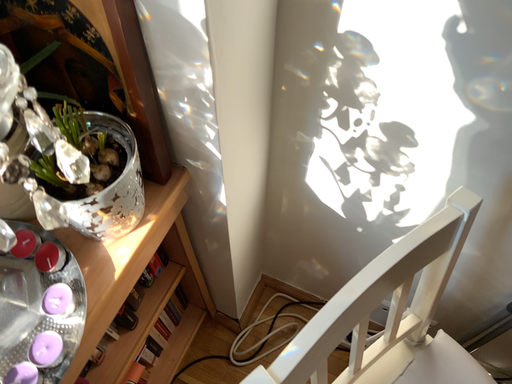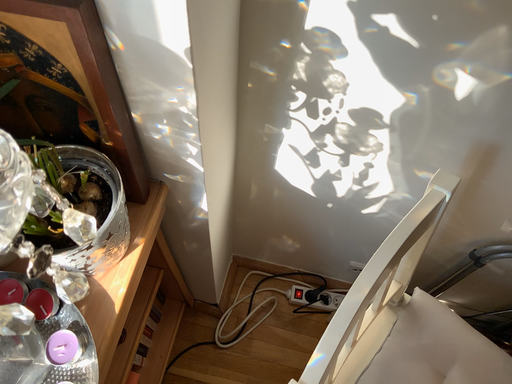
Question: Which way did the camera rotate in the video?

Choices:
 (A) rotated left
 (B) rotated right

Answer: (B)